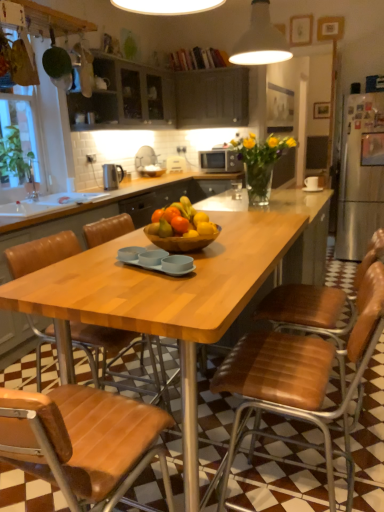
Question: Choose the correct answer: Is white glossy sink at lower left inside wooden table at center or outside it?

Choices:
 (A) outside
 (B) inside

Answer: (A)

Question: Is white glossy sink at lower left taller or shorter than wooden table at center?

Choices:
 (A) short
 (B) tall

Answer: (A)

Question: Which is farther from the brown leather chair at lower left, placed as the first chair when sorted from left to right?

Choices:
 (A) matte dark wood cabinets at upper center, the first cabinetry viewed from the right
 (B) translucent glass vase at center
 (C) matte silver microwave at center
 (D) white matte lampshade at upper center
 (E) brown leather chair at center, the 1th chair in the right-to-left sequence

Answer: (A)

Question: Which is nearer to the wooden table at center?

Choices:
 (A) brown leather chair at lower left, placed as the first chair when sorted from left to right
 (B) matte gray cabinets at upper center, acting as the 2th cabinetry starting from the right
 (C) polished stainless steel kettle at upper left
 (D) matte dark wood cabinets at upper center, marked as the 2th cabinetry in a left-to-right arrangement
 (E) translucent glass vase at center

Answer: (E)